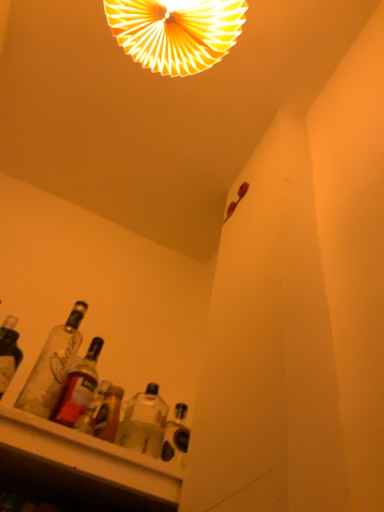
Question: From a real-world perspective, is clear glass bottles at lower left, the second bottle when ordered from right to left, positioned over white paper fan at upper center based on gravity?

Choices:
 (A) yes
 (B) no

Answer: (B)

Question: Is clear glass bottles at lower left, the 1th bottle positioned from the left, to the left of white paper fan at upper center from the viewer's perspective?

Choices:
 (A) yes
 (B) no

Answer: (A)

Question: Considering the relative sizes of clear glass bottles at lower left, the 1th bottle positioned from the left, and white paper fan at upper center in the image provided, is clear glass bottles at lower left, the 1th bottle positioned from the left, smaller than white paper fan at upper center?

Choices:
 (A) yes
 (B) no

Answer: (A)

Question: Can you confirm if clear glass bottles at lower left, the 1th bottle positioned from the left, is shorter than white paper fan at upper center?

Choices:
 (A) yes
 (B) no

Answer: (A)

Question: Is clear glass bottles at lower left, the 1th bottle positioned from the left, not inside white paper fan at upper center?

Choices:
 (A) yes
 (B) no

Answer: (A)

Question: Can you confirm if clear glass bottles at lower left, the 1th bottle positioned from the left, is bigger than white paper fan at upper center?

Choices:
 (A) yes
 (B) no

Answer: (B)

Question: Does white paper fan at upper center appear on the left side of clear glass bottles at lower left, the second bottle when ordered from right to left?

Choices:
 (A) no
 (B) yes

Answer: (A)

Question: Considering the relative positions of white paper fan at upper center and clear glass bottles at lower left, the second bottle when ordered from right to left, in the image provided, is white paper fan at upper center to the right of clear glass bottles at lower left, the second bottle when ordered from right to left, from the viewer's perspective?

Choices:
 (A) yes
 (B) no

Answer: (A)

Question: From the image's perspective, would you say white paper fan at upper center is shown under clear glass bottles at lower left, the 1th bottle positioned from the left?

Choices:
 (A) no
 (B) yes

Answer: (A)

Question: From a real-world perspective, is white paper fan at upper center under clear glass bottles at lower left, the second bottle when ordered from right to left?

Choices:
 (A) yes
 (B) no

Answer: (B)

Question: Is clear glass bottles at lower left, the 1th bottle positioned from the left, completely or partially inside white paper fan at upper center?

Choices:
 (A) yes
 (B) no

Answer: (B)

Question: Is white paper fan at upper center further to camera compared to clear glass bottles at lower left, the second bottle when ordered from right to left?

Choices:
 (A) no
 (B) yes

Answer: (B)

Question: Is clear glass bottles at lower left, the second bottle when ordered from right to left, beside translucent glass bottle at lower left, which is counted as the 1th bottle, starting from the right?

Choices:
 (A) no
 (B) yes

Answer: (B)